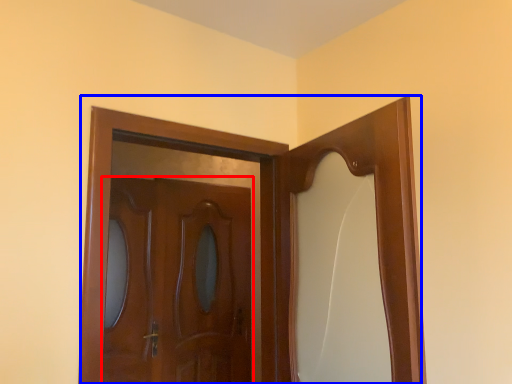
Question: Which object appears closest to the camera in this image, door (highlighted by a red box) or door (highlighted by a blue box)?

Choices:
 (A) door
 (B) door

Answer: (B)